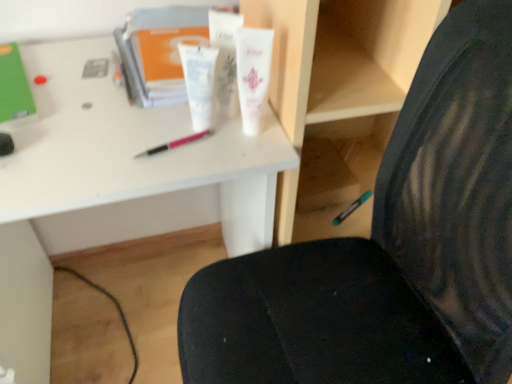
Identify the location of free space between green matte folder at upper left, the 1th stationery from the left, and white glossy tube at center, arranged as the 1th toiletry when viewed from the left. point(85,105).